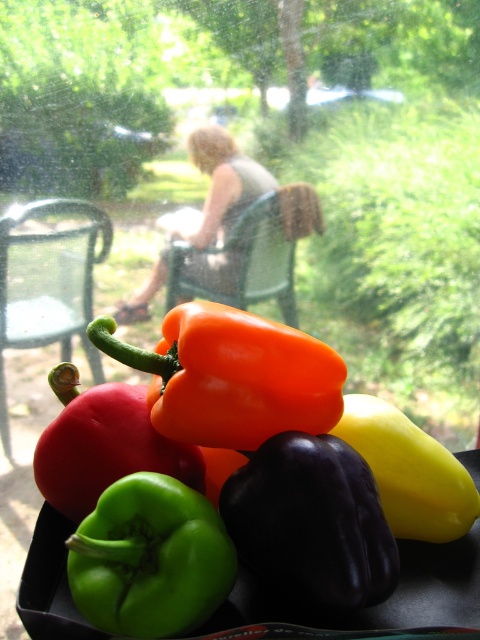
Question: Does orange glossy bell pepper at center appear over blonde hair at center?

Choices:
 (A) no
 (B) yes

Answer: (A)

Question: Which object is the closest to the green matte bell pepper at lower left?

Choices:
 (A) blonde hair at center
 (B) orange glossy bell pepper at center

Answer: (B)

Question: Which point appears closest to the camera in this image?

Choices:
 (A) (171, 365)
 (B) (189, 579)

Answer: (B)

Question: Does orange glossy bell pepper at center lie in front of blonde hair at center?

Choices:
 (A) yes
 (B) no

Answer: (A)

Question: Can you confirm if orange glossy bell pepper at center is smaller than green matte bell pepper at lower left?

Choices:
 (A) no
 (B) yes

Answer: (A)

Question: Considering the real-world distances, which object is closest to the green matte bell pepper at lower left?

Choices:
 (A) orange glossy bell pepper at center
 (B) blonde hair at center

Answer: (A)